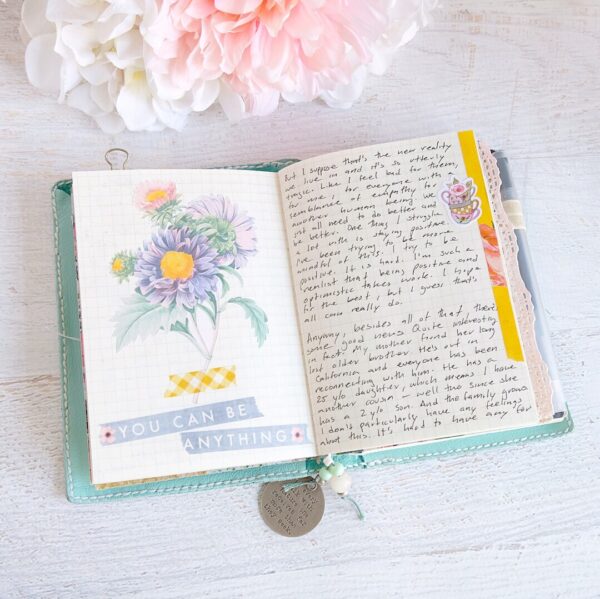
Identify the location of blue backing of book. This screenshot has height=599, width=600. (420, 450), (277, 464), (76, 384), (275, 165).